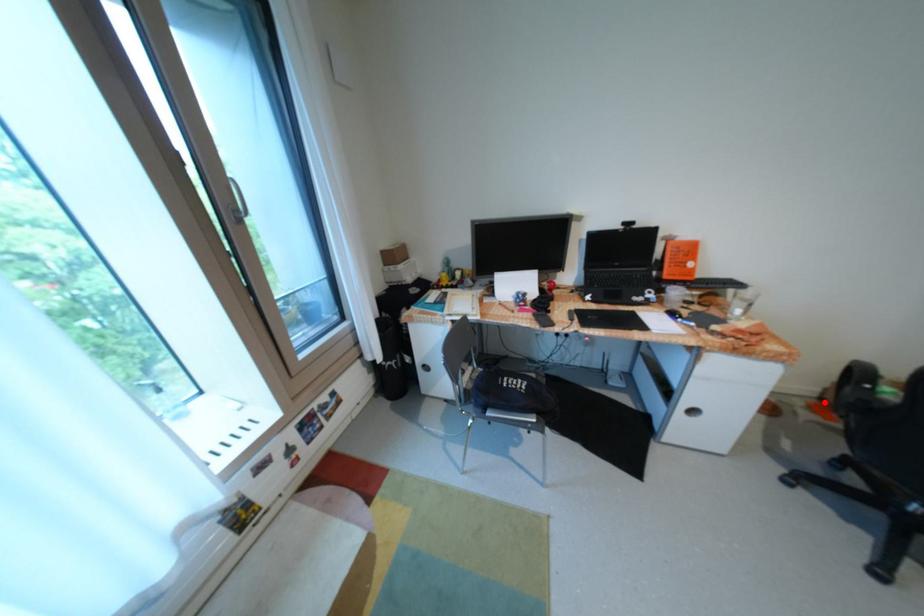
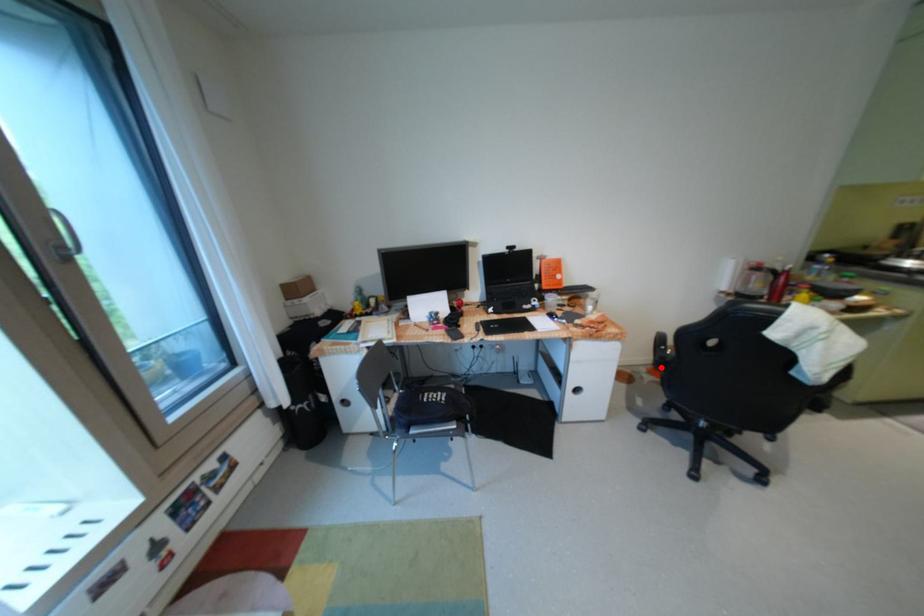
I am providing you with two images of the same scene from different viewpoints. A red point is marked on the first image and another point is marked on the second image. Does the point marked in image1 correspond to the same location as the one in image2?

Yes